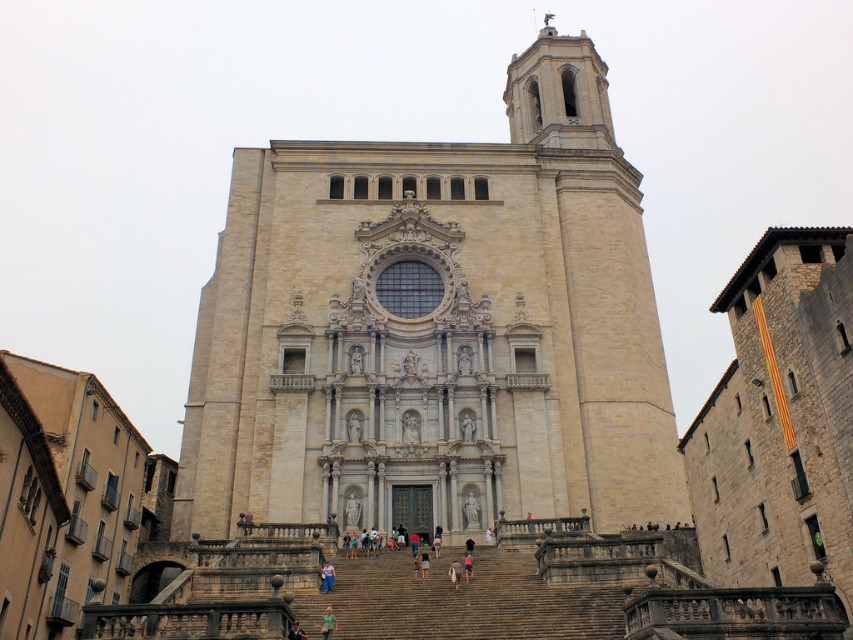
Does brown stone stairs at center appear over blue denim jeans at center?

Actually, brown stone stairs at center is below blue denim jeans at center.

Can you confirm if brown stone stairs at center is bigger than blue denim jeans at center?

Correct, brown stone stairs at center is larger in size than blue denim jeans at center.

What do you see at coordinates (459, 600) in the screenshot? The height and width of the screenshot is (640, 853). I see `brown stone stairs at center` at bounding box center [459, 600].

The image size is (853, 640). Identify the location of brown stone stairs at center. [459, 600].

Does green fabric bag at center appear under light brown stone person at center?

Yes.

Is green fabric bag at center to the left of light brown stone person at center from the viewer's perspective?

Indeed, green fabric bag at center is positioned on the left side of light brown stone person at center.

Who is more distant from viewer, (326, 608) or (456, 579)?

The point (456, 579) is more distant.

Locate an element on the screen. Image resolution: width=853 pixels, height=640 pixels. green fabric bag at center is located at coordinates (328, 624).

Is point (326, 628) positioned behind point (467, 572)?

That is False.

Where is `green fabric bag at center`? This screenshot has width=853, height=640. green fabric bag at center is located at coordinates (328, 624).